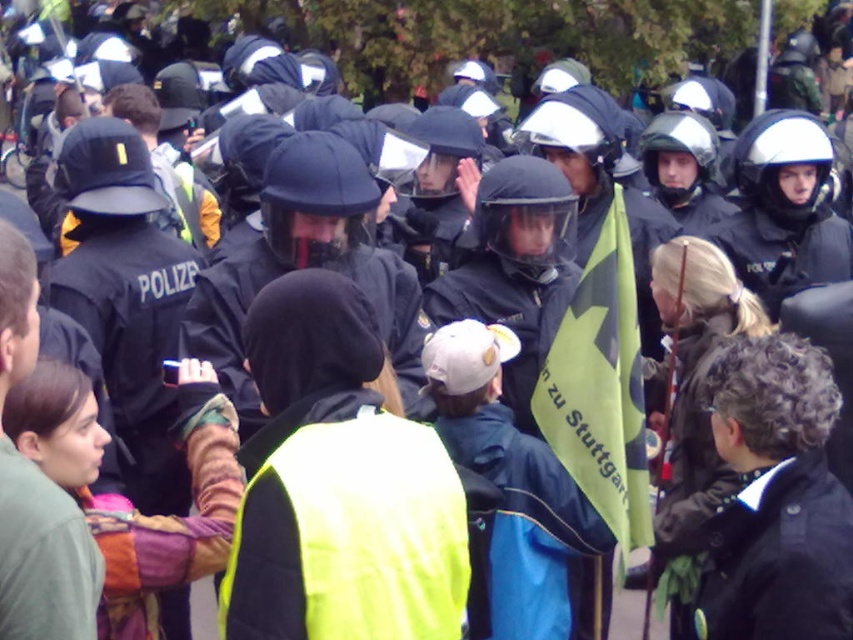
Which is behind, point (300, 296) or point (813, 374)?

Point (813, 374)

Is bright yellow reflective vest at center thinner than black leather jacket at lower right?

Incorrect, bright yellow reflective vest at center's width is not less than black leather jacket at lower right's.

Locate an element on the screen. bright yellow reflective vest at center is located at coordinates (338, 484).

Based on the photo, is bright yellow reflective vest at center positioned before green fabric flag at center?

Yes, it is.

From the picture: Is bright yellow reflective vest at center shorter than green fabric flag at center?

Correct, bright yellow reflective vest at center is not as tall as green fabric flag at center.

Does point (375, 556) lie in front of point (581, 403)?

That is True.

Find the location of a particular element. This screenshot has height=640, width=853. bright yellow reflective vest at center is located at coordinates [338, 484].

Is point (809, 410) more distant than point (579, 388)?

That is False.

Is black leather jacket at lower right behind green fabric flag at center?

No, black leather jacket at lower right is in front of green fabric flag at center.

Is point (705, 579) more distant than point (624, 273)?

No.

This screenshot has height=640, width=853. Identify the location of black leather jacket at lower right. (776, 499).